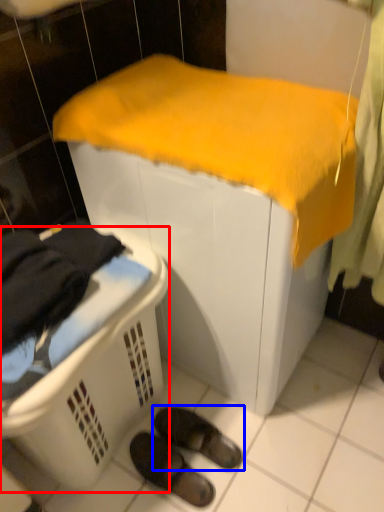
Question: Which object appears closest to the camera in this image, laundry basket (highlighted by a red box) or footwear (highlighted by a blue box)?

Choices:
 (A) laundry basket
 (B) footwear

Answer: (A)